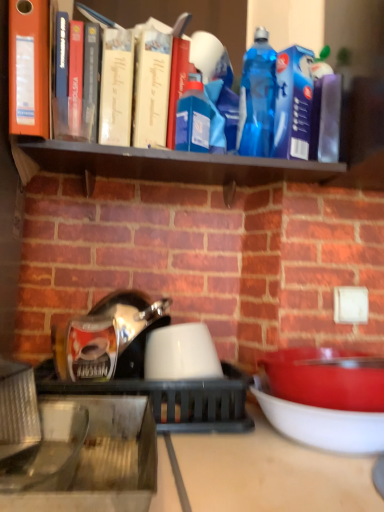
Question: Considering the positions of black matte shelf at upper center and matte red bowl at right, the 2th bowl when ordered from right to left, in the image, is black matte shelf at upper center wider or thinner than matte red bowl at right, the 2th bowl when ordered from right to left,?

Choices:
 (A) thin
 (B) wide

Answer: (A)

Question: Considering the positions of point (51, 160) and point (374, 388), is point (51, 160) closer or farther from the camera than point (374, 388)?

Choices:
 (A) closer
 (B) farther

Answer: (B)

Question: Considering the real-world distances, which object is farthest from the matte red bowl at right, the second bowl when ordered from left to right?

Choices:
 (A) white glossy bowl at center, the 3th bowl viewed from the right
 (B) black matte shelf at upper center
 (C) matte white bowl at lower right, which is the 3th bowl from left to right
 (D) white glossy kettle at center

Answer: (B)

Question: Based on their relative distances, which object is nearer to the white glossy bowl at center, the 3th bowl viewed from the right?

Choices:
 (A) white glossy kettle at center
 (B) matte white bowl at lower right, which is the 3th bowl from left to right
 (C) black matte shelf at upper center
 (D) matte red bowl at right, the second bowl when ordered from left to right

Answer: (A)